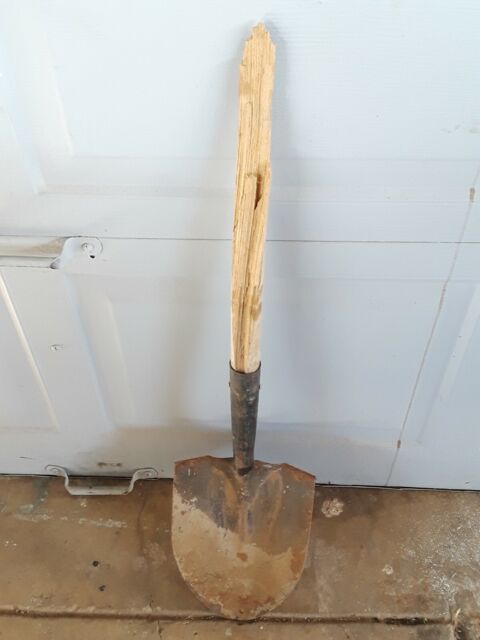
The image size is (480, 640). I want to click on wood handle, so click(254, 211).